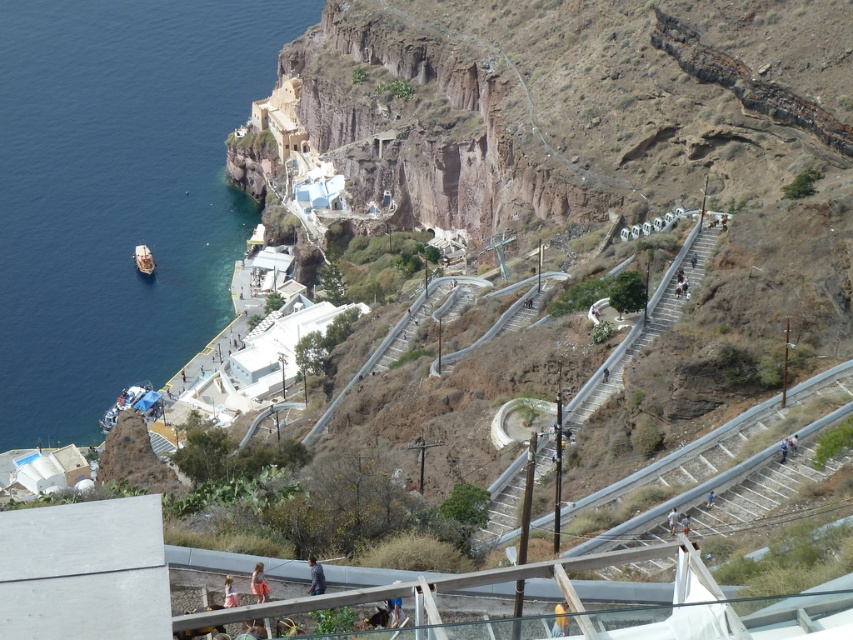
Who is shorter, light brown fabric pants at center or blue fabric bag at center?

blue fabric bag at center is shorter.

Who is positioned more to the right, light brown fabric pants at center or blue fabric bag at center?

Positioned to the right is blue fabric bag at center.

Is point (672, 531) more distant than point (798, 444)?

No.

Identify the location of light brown fabric pants at center. (672, 518).

Consider the image. Who is taller, pink fabric skirt at lower center or light brown fabric pants at center?

Standing taller between the two is pink fabric skirt at lower center.

Between pink fabric skirt at lower center and light brown fabric pants at center, which one appears on the right side from the viewer's perspective?

From the viewer's perspective, light brown fabric pants at center appears more on the right side.

Which is in front, point (236, 593) or point (672, 515)?

Point (236, 593) is in front.

The image size is (853, 640). I want to click on pink fabric skirt at lower center, so click(229, 593).

Does blue liquid water at lower left have a lesser height compared to matte pink dress at center?

No, blue liquid water at lower left is not shorter than matte pink dress at center.

Where is `blue liquid water at lower left`? The image size is (853, 640). blue liquid water at lower left is located at coordinates (119, 193).